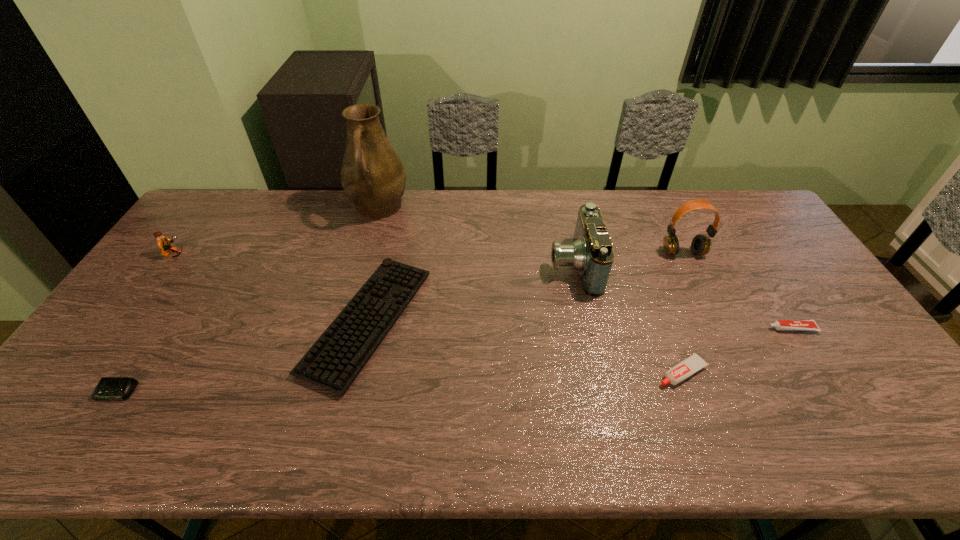
Identify the location of vacant region located on the back of the left toothpaste. (664, 326).

The width and height of the screenshot is (960, 540). What are the coordinates of `free space located at the nozzle of the farther toothpaste` in the screenshot? It's located at (636, 328).

Identify the location of vacant space located 0.060m at the nozzle of the farther toothpaste. The height and width of the screenshot is (540, 960). (746, 328).

Locate an element on the screen. The height and width of the screenshot is (540, 960). free spot located at the nozzle of the farther toothpaste is located at coordinates (684, 328).

In order to click on object that is at the far edge in this screenshot , I will do `click(373, 177)`.

What are the coordinates of `Lego at the left edge` in the screenshot? It's located at (163, 242).

The height and width of the screenshot is (540, 960). I want to click on alarm clock present at the left edge, so click(108, 388).

Find the location of `object that is at the right edge`. object that is at the right edge is located at coordinates (808, 325).

Find the location of a particular element. The image size is (960, 540). vacant space at the far edge of the desktop is located at coordinates (566, 195).

Locate an element on the screen. The image size is (960, 540). vacant space at the near edge is located at coordinates coord(664,431).